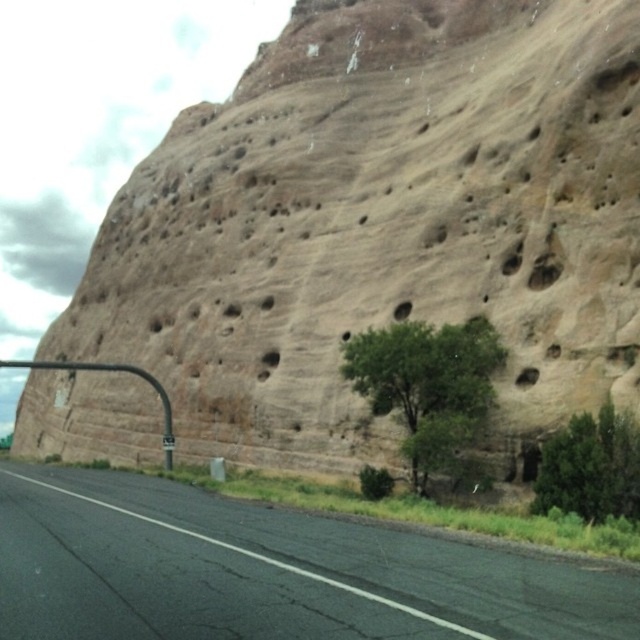
Question: Can you confirm if green leafy tree at center is bigger than green leafy tree at lower right?

Choices:
 (A) yes
 (B) no

Answer: (A)

Question: Is green leafy tree at center closer to the viewer compared to green leafy tree at lower right?

Choices:
 (A) yes
 (B) no

Answer: (B)

Question: Which point is farther to the camera?

Choices:
 (A) green leafy tree at center
 (B) green leafy tree at lower right

Answer: (A)

Question: Which point appears closest to the camera in this image?

Choices:
 (A) (627, 444)
 (B) (22, 508)

Answer: (A)

Question: Which point is closer to the camera taking this photo?

Choices:
 (A) (531, 508)
 (B) (461, 328)

Answer: (A)

Question: Does black asphalt road at center have a greater width compared to green leafy tree at lower right?

Choices:
 (A) no
 (B) yes

Answer: (B)